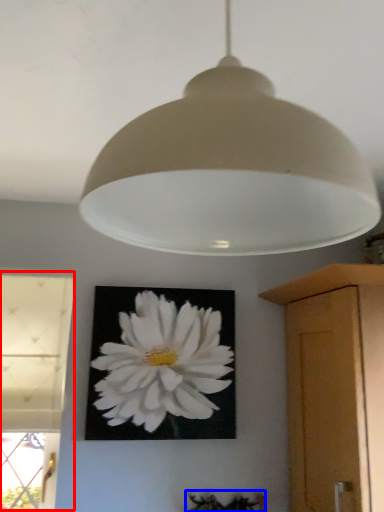
Question: Among these objects, which one is farthest to the camera, window (highlighted by a red box) or plant (highlighted by a blue box)?

Choices:
 (A) window
 (B) plant

Answer: (B)